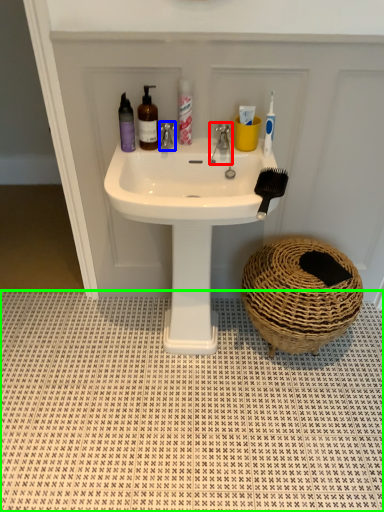
Question: Based on their relative distances, which object is nearer to tap (highlighted by a red box)? Choose from tap (highlighted by a blue box) and tile (highlighted by a green box).

Choices:
 (A) tap
 (B) tile

Answer: (A)